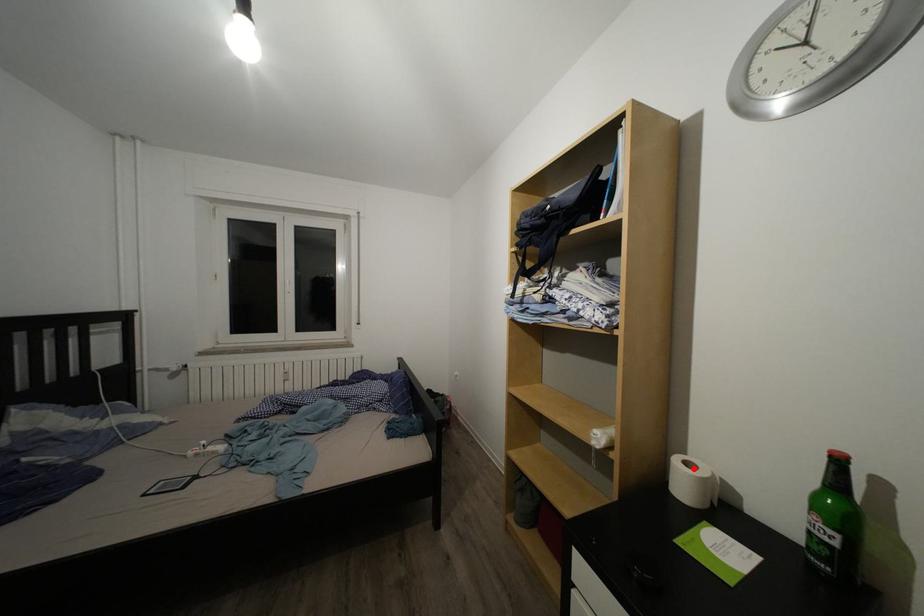
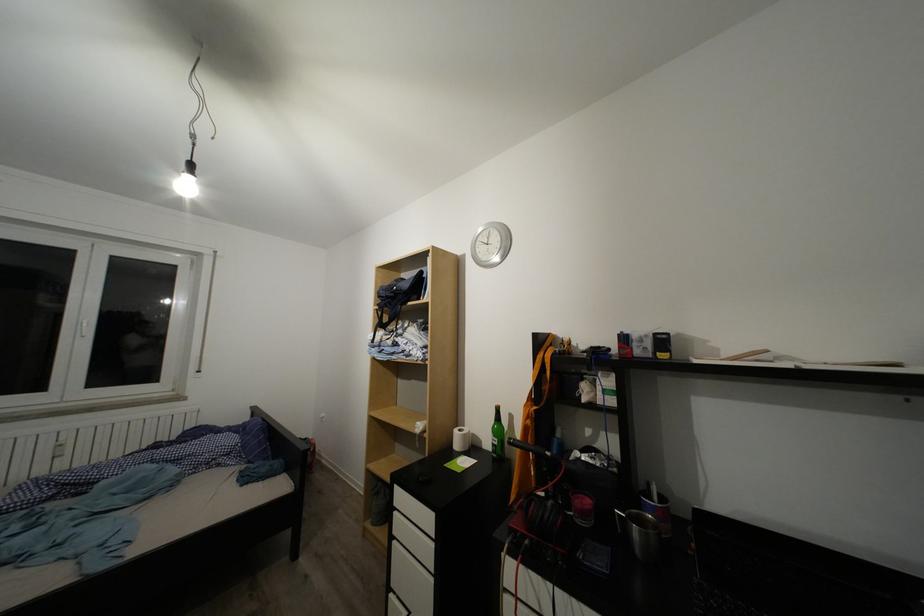
Locate, in the second image, the point that corresponds to the highlighted location in the first image.

(468, 436)